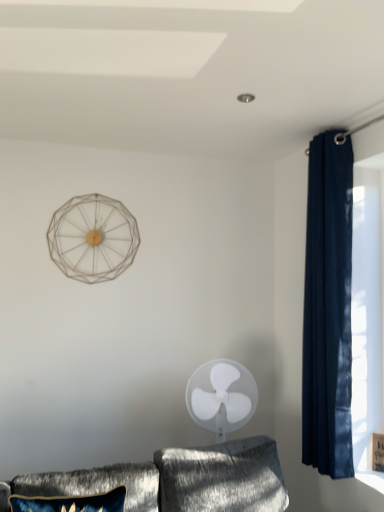
Question: Considering the relative sizes of white plastic fan at center and navy velvet curtain at right in the image provided, is white plastic fan at center shorter than navy velvet curtain at right?

Choices:
 (A) no
 (B) yes

Answer: (B)

Question: From the image's perspective, would you say white plastic fan at center is shown under navy velvet curtain at right?

Choices:
 (A) no
 (B) yes

Answer: (B)

Question: Is white plastic fan at center closer to the viewer compared to navy velvet curtain at right?

Choices:
 (A) yes
 (B) no

Answer: (B)

Question: From a real-world perspective, is white plastic fan at center on navy velvet curtain at right?

Choices:
 (A) no
 (B) yes

Answer: (A)

Question: Can you confirm if white plastic fan at center is positioned to the right of navy velvet curtain at right?

Choices:
 (A) no
 (B) yes

Answer: (A)

Question: Is there a large distance between white plastic fan at center and navy velvet curtain at right?

Choices:
 (A) yes
 (B) no

Answer: (B)

Question: Is white plastic fan at center not within velvet blue pillow at lower left?

Choices:
 (A) no
 (B) yes

Answer: (B)

Question: Is white plastic fan at center facing towards velvet blue pillow at lower left?

Choices:
 (A) no
 (B) yes

Answer: (A)

Question: Can you confirm if white plastic fan at center is shorter than velvet blue pillow at lower left?

Choices:
 (A) yes
 (B) no

Answer: (B)

Question: Is white plastic fan at center thinner than velvet blue pillow at lower left?

Choices:
 (A) yes
 (B) no

Answer: (B)

Question: Considering the relative sizes of white plastic fan at center and velvet blue pillow at lower left in the image provided, is white plastic fan at center wider than velvet blue pillow at lower left?

Choices:
 (A) yes
 (B) no

Answer: (A)

Question: From a real-world perspective, is white plastic fan at center physically above velvet blue pillow at lower left?

Choices:
 (A) no
 (B) yes

Answer: (B)

Question: Could you tell me if navy velvet curtain at right is turned towards velvet blue pillow at lower left?

Choices:
 (A) no
 (B) yes

Answer: (B)